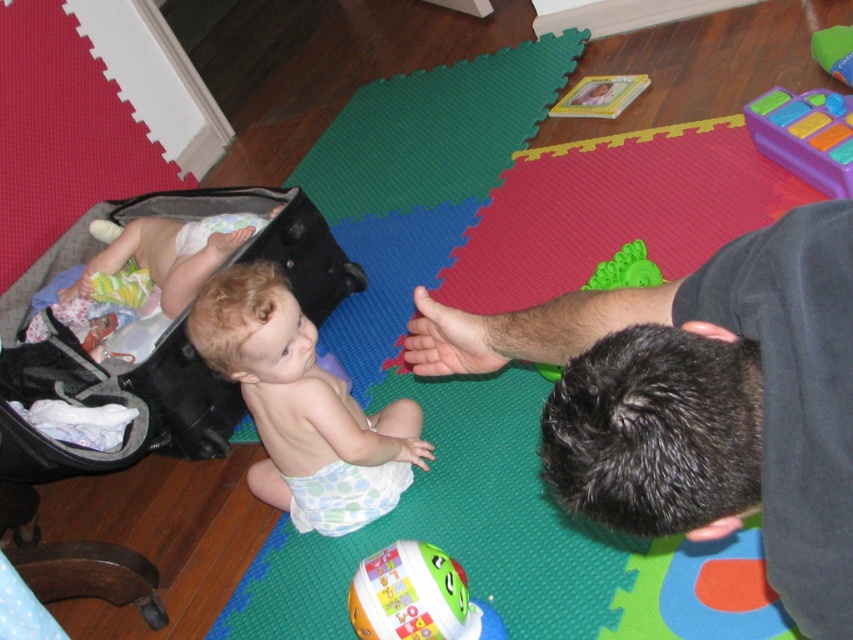
Question: Which of the following is the farthest from the observer?

Choices:
 (A) (457, 589)
 (B) (120, 211)

Answer: (B)

Question: Can you confirm if green rubber toy at center is bigger than white cloth diaper at center?

Choices:
 (A) yes
 (B) no

Answer: (B)

Question: Is purple plastic toy at upper right closer to the viewer compared to green rubber toy at center?

Choices:
 (A) yes
 (B) no

Answer: (B)

Question: Where is light blue diaper at center located in relation to green rubber toy at center in the image?

Choices:
 (A) below
 (B) above

Answer: (A)

Question: Estimate the real-world distances between objects in this image. Which object is closer to the black fabric baby carriage at left?

Choices:
 (A) white plastic toy at lower center
 (B) white cloth diaper at center
 (C) light blue diaper at center

Answer: (B)

Question: Estimate the real-world distances between objects in this image. Which object is closer to the light blue diaper at center?

Choices:
 (A) purple plastic toy at upper right
 (B) black fabric baby carriage at left
 (C) white plastic toy at lower center
 (D) green rubber toy at center

Answer: (C)